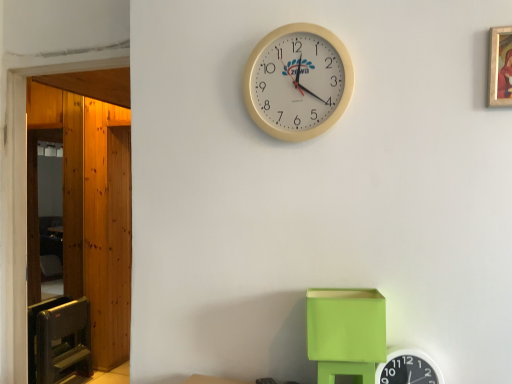
Question: Is beige plastic wall clock at upper center, placed as the first wall clock when sorted from top to bottom, positioned with its back to wooden door at left?

Choices:
 (A) no
 (B) yes

Answer: (A)

Question: Is beige plastic wall clock at upper center, marked as the 1th wall clock in a left-to-right arrangement, at the right side of wooden door at left?

Choices:
 (A) no
 (B) yes

Answer: (B)

Question: Is wooden door at left inside beige plastic wall clock at upper center, placed as the first wall clock when sorted from top to bottom?

Choices:
 (A) no
 (B) yes

Answer: (A)

Question: Is beige plastic wall clock at upper center, placed as the first wall clock when sorted from top to bottom, bigger than wooden door at left?

Choices:
 (A) no
 (B) yes

Answer: (A)

Question: Are beige plastic wall clock at upper center, which is the second wall clock in right-to-left order, and wooden door at left making contact?

Choices:
 (A) yes
 (B) no

Answer: (B)

Question: Considering the relative positions of lime green plastic cube at lower center and white plastic wall clock at upper center, which is the 2th wall clock in left-to-right order, in the image provided, is lime green plastic cube at lower center to the left or to the right of white plastic wall clock at upper center, which is the 2th wall clock in left-to-right order,?

Choices:
 (A) right
 (B) left

Answer: (B)

Question: Considering the positions of lime green plastic cube at lower center and white plastic wall clock at upper center, which is the 2th wall clock in left-to-right order, in the image, is lime green plastic cube at lower center bigger or smaller than white plastic wall clock at upper center, which is the 2th wall clock in left-to-right order,?

Choices:
 (A) big
 (B) small

Answer: (A)

Question: Is lime green plastic cube at lower center inside the boundaries of white plastic wall clock at upper center, the first wall clock ordered from the bottom, or outside?

Choices:
 (A) inside
 (B) outside

Answer: (B)

Question: From their relative heights in the image, would you say lime green plastic cube at lower center is taller or shorter than white plastic wall clock at upper center, acting as the second wall clock starting from the top?

Choices:
 (A) tall
 (B) short

Answer: (A)

Question: Is wooden door at left in front of or behind white plastic wall clock at upper center, which is the 2th wall clock in left-to-right order, in the image?

Choices:
 (A) behind
 (B) front

Answer: (A)

Question: Do you think wooden door at left is within white plastic wall clock at upper center, the 1th wall clock when ordered from right to left, or outside of it?

Choices:
 (A) outside
 (B) inside

Answer: (A)

Question: From the image's perspective, is wooden door at left located above or below white plastic wall clock at upper center, acting as the second wall clock starting from the top?

Choices:
 (A) above
 (B) below

Answer: (A)

Question: Is point (66, 96) positioned closer to the camera than point (400, 365)?

Choices:
 (A) farther
 (B) closer

Answer: (A)

Question: From the image's perspective, relative to beige plastic wall clock at upper center, which is the second wall clock in right-to-left order, is gold-framed painting at upper right above or below?

Choices:
 (A) below
 (B) above

Answer: (B)

Question: Is gold-framed painting at upper right wider or thinner than beige plastic wall clock at upper center, which is the 2th wall clock in bottom-to-top order?

Choices:
 (A) thin
 (B) wide

Answer: (A)